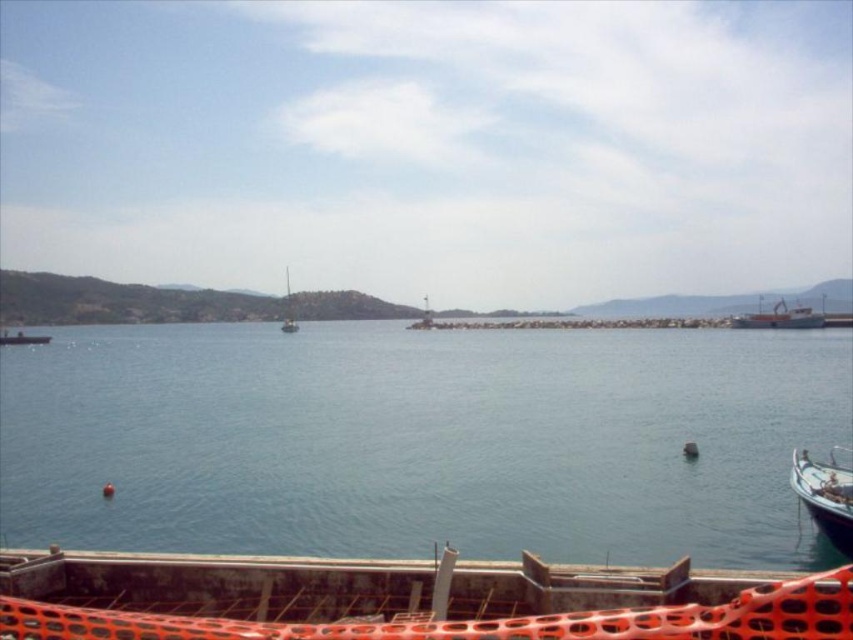
Does blue water at center appear over orange painted metal boat at right?

Incorrect, blue water at center is not positioned above orange painted metal boat at right.

How far apart are blue water at center and orange painted metal boat at right?

The distance of blue water at center from orange painted metal boat at right is 48.13 meters.

Describe the element at coordinates (421, 440) in the screenshot. The height and width of the screenshot is (640, 853). I see `blue water at center` at that location.

The height and width of the screenshot is (640, 853). Identify the location of blue water at center. (421, 440).

Is point (846, 468) positioned in front of point (814, 314)?

Yes, point (846, 468) is in front of point (814, 314).

Is point (801, 483) positioned after point (810, 324)?

No, it is not.

Where is `white wooden boat at lower right`? white wooden boat at lower right is located at coordinates (825, 497).

Does point (796, 316) come farther from viewer compared to point (282, 332)?

No, it is in front of (282, 332).

Is the position of orange painted metal boat at right more distant than that of white sailboat at center?

No, it is not.

Locate an element on the screen. orange painted metal boat at right is located at coordinates (779, 317).